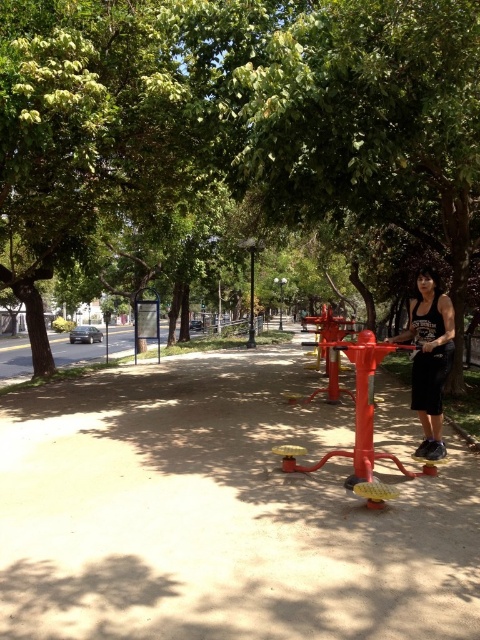
In the scene shown: Between matte concrete pavement at center and black tank top at center, which one appears on the left side from the viewer's perspective?

matte concrete pavement at center

Looking at this image, who is taller, matte concrete pavement at center or black tank top at center?

With more height is black tank top at center.

This screenshot has width=480, height=640. Describe the element at coordinates (218, 515) in the screenshot. I see `matte concrete pavement at center` at that location.

This screenshot has width=480, height=640. In order to click on matte concrete pavement at center in this screenshot , I will do `click(218, 515)`.

Is green leafy tree at center shorter than black tank top at center?

Incorrect, green leafy tree at center's height does not fall short of black tank top at center's.

Can you confirm if green leafy tree at center is taller than black tank top at center?

Indeed, green leafy tree at center has a greater height compared to black tank top at center.

Is point (36, 225) farther from viewer compared to point (442, 372)?

Yes, point (36, 225) is farther from viewer.

Find the location of a particular element. green leafy tree at center is located at coordinates (239, 116).

Image resolution: width=480 pixels, height=640 pixels. What do you see at coordinates (430, 358) in the screenshot? I see `black tank top at center` at bounding box center [430, 358].

Does point (439, 388) come in front of point (252, 298)?

Yes, it is in front of point (252, 298).

Which is in front, point (412, 376) or point (251, 342)?

Point (412, 376)

The width and height of the screenshot is (480, 640). Identify the location of black tank top at center. (430, 358).